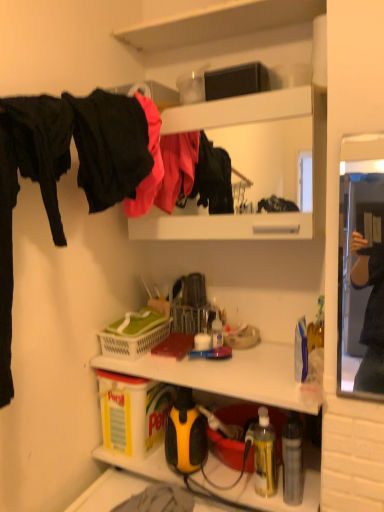
Question: Is yellow plastic box at lower left, placed as the first box when sorted from left to right, shorter than white plastic picnic basket at center?

Choices:
 (A) no
 (B) yes

Answer: (A)

Question: Is yellow plastic box at lower left, the second box in the top-to-bottom sequence, far away from white plastic picnic basket at center?

Choices:
 (A) no
 (B) yes

Answer: (A)

Question: Is yellow plastic box at lower left, placed as the first box when sorted from left to right, facing towards white plastic picnic basket at center?

Choices:
 (A) no
 (B) yes

Answer: (A)

Question: Is yellow plastic box at lower left, the second box in the top-to-bottom sequence, wider than white plastic picnic basket at center?

Choices:
 (A) no
 (B) yes

Answer: (A)

Question: Does yellow plastic box at lower left, placed as the first box when sorted from left to right, lie behind white plastic picnic basket at center?

Choices:
 (A) yes
 (B) no

Answer: (B)

Question: In terms of width, does white plastic picnic basket at center look wider or thinner when compared to black matte fabric at left, the 1th clothing positioned from the front?

Choices:
 (A) thin
 (B) wide

Answer: (B)

Question: From a real-world perspective, is white plastic picnic basket at center physically located above or below black matte fabric at left, the 1th clothing positioned from the front?

Choices:
 (A) below
 (B) above

Answer: (A)

Question: Visually, is white plastic picnic basket at center positioned to the left or to the right of black matte fabric at left, the second clothing in the back-to-front sequence?

Choices:
 (A) right
 (B) left

Answer: (A)

Question: Is white plastic picnic basket at center taller or shorter than black matte fabric at left, the second clothing in the back-to-front sequence?

Choices:
 (A) tall
 (B) short

Answer: (B)

Question: Is white plastic picnic basket at center bigger or smaller than matte black jacket at upper center, which ranks as the 2th clothing in front-to-back order?

Choices:
 (A) big
 (B) small

Answer: (B)

Question: From their relative heights in the image, would you say white plastic picnic basket at center is taller or shorter than matte black jacket at upper center, which ranks as the 2th clothing in front-to-back order?

Choices:
 (A) tall
 (B) short

Answer: (B)

Question: Which is correct: white plastic picnic basket at center is inside matte black jacket at upper center, which ranks as the 2th clothing in front-to-back order, or outside of it?

Choices:
 (A) outside
 (B) inside

Answer: (A)

Question: Considering their positions, is white plastic picnic basket at center located in front of or behind matte black jacket at upper center, placed as the first clothing when sorted from back to front?

Choices:
 (A) behind
 (B) front

Answer: (A)

Question: Would you say black matte box at upper center, which ranks as the 2th box in bottom-to-top order, is to the left or to the right of translucent yellow bottle at lower right, which is the 2th bottle in right-to-left order, in the picture?

Choices:
 (A) right
 (B) left

Answer: (B)

Question: From a real-world perspective, is black matte box at upper center, the first box when ordered from top to bottom, positioned above or below translucent yellow bottle at lower right, marked as the first bottle in a left-to-right arrangement?

Choices:
 (A) above
 (B) below

Answer: (A)